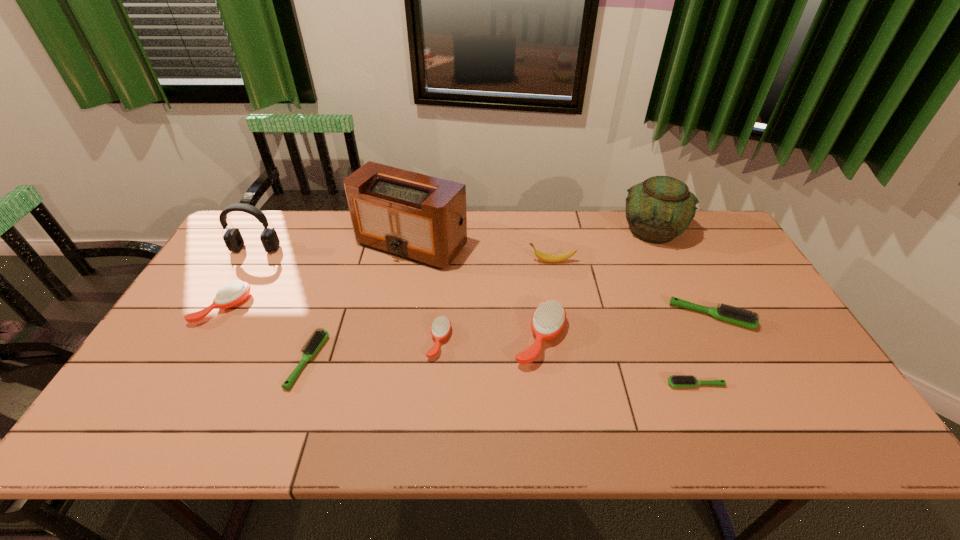
You are a GUI agent. You are given a task and a screenshot of the screen. Output one action in this format:
    pyautogui.click(x=<x>, y=<y>)
    Task: Click on the vacant area located at the stem of the yellow banana
    The image size is (960, 540).
    Given the screenshot: What is the action you would take?
    pyautogui.click(x=440, y=261)

At what (x,y) coordinates should I click in order to perform the action: click on free region located on the right of the rightmost orange hairbrush. Please return your answer as a coordinate pair (x, y). Looking at the image, I should click on (594, 339).

Where is `free space located 0.380m on the back of the fifth shortest object`? This screenshot has height=540, width=960. free space located 0.380m on the back of the fifth shortest object is located at coordinates (276, 215).

The height and width of the screenshot is (540, 960). I want to click on free spot located 0.170m on the left of the biggest light hairbrush, so click(612, 316).

Where is `vacant space located 0.300m on the right of the second orange hairbrush from left to right`? vacant space located 0.300m on the right of the second orange hairbrush from left to right is located at coordinates (564, 341).

You are a GUI agent. You are given a task and a screenshot of the screen. Output one action in this format:
    pyautogui.click(x=<x>, y=<y>)
    Task: Click on the free region located on the back of the second smallest light hairbrush
    The width and height of the screenshot is (960, 540).
    Given the screenshot: What is the action you would take?
    pyautogui.click(x=346, y=253)

Find the location of a particular element. The width and height of the screenshot is (960, 540). vacant space located 0.340m on the back of the shortest hairbrush is located at coordinates (653, 284).

Find the location of a particular element. The height and width of the screenshot is (540, 960). radio receiver located in the far edge section of the desktop is located at coordinates (420, 218).

The image size is (960, 540). Find the location of `pottery that is at the far edge`. pottery that is at the far edge is located at coordinates (659, 209).

You are a GUI agent. You are given a task and a screenshot of the screen. Output one action in this format:
    pyautogui.click(x=<x>, y=<y>)
    Task: Click on the headset present at the far edge
    The image size is (960, 540).
    Given the screenshot: What is the action you would take?
    pyautogui.click(x=233, y=239)